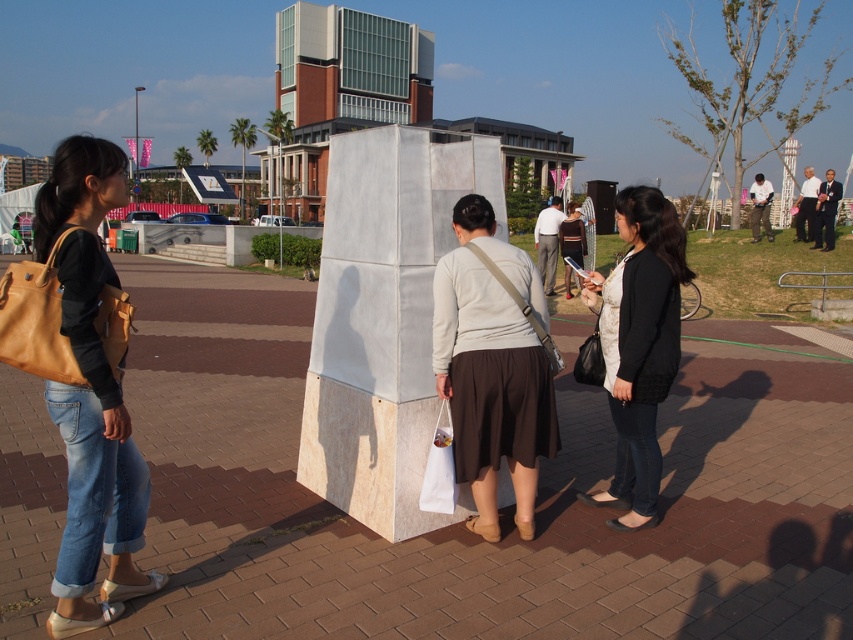
Which is below, denim jeans at left or matte beige sweater at center?

matte beige sweater at center is lower down.

You are a GUI agent. You are given a task and a screenshot of the screen. Output one action in this format:
    pyautogui.click(x=<x>, y=<y>)
    Task: Click on the denim jeans at left
    The image size is (853, 640).
    Given the screenshot: What is the action you would take?
    [x=90, y=394]

Locate an element on the screen. The image size is (853, 640). denim jeans at left is located at coordinates (90, 394).

From the picture: Who is positioned more to the left, denim jeans at left or black matte jacket at center?

From the viewer's perspective, denim jeans at left appears more on the left side.

The height and width of the screenshot is (640, 853). What do you see at coordinates (90, 394) in the screenshot? I see `denim jeans at left` at bounding box center [90, 394].

Locate an element on the screen. This screenshot has width=853, height=640. denim jeans at left is located at coordinates (90, 394).

In the scene shown: Is matte beige sweater at center wider than matte gray cube at center?

Correct, the width of matte beige sweater at center exceeds that of matte gray cube at center.

Who is shorter, matte beige sweater at center or matte gray cube at center?

matte beige sweater at center is shorter.

This screenshot has width=853, height=640. I want to click on matte beige sweater at center, so click(x=492, y=365).